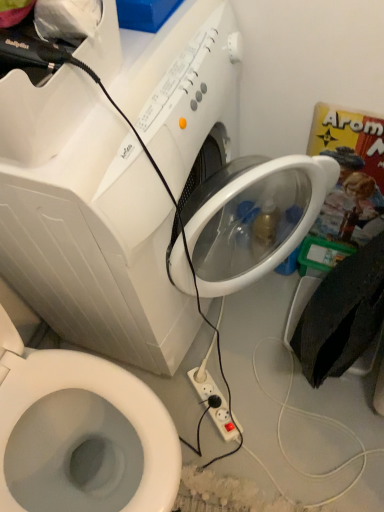
Describe the element at coordinates (209, 398) in the screenshot. I see `white plastic power plugs and sockets at lower center` at that location.

The width and height of the screenshot is (384, 512). I want to click on white plastic washing machine at upper center, so click(99, 242).

What is the approximate height of white plastic bidet at lower left?

The height of white plastic bidet at lower left is 29.74 inches.

This screenshot has height=512, width=384. Find the location of `white plastic power plugs and sockets at lower center`. white plastic power plugs and sockets at lower center is located at coordinates (209, 398).

Does white plastic washing machine at upper center have a greater height compared to white plastic bidet at lower left?

Indeed, white plastic washing machine at upper center has a greater height compared to white plastic bidet at lower left.

Which is more to the right, white plastic washing machine at upper center or white plastic bidet at lower left?

white plastic washing machine at upper center.

What's the angular difference between white plastic washing machine at upper center and white plastic bidet at lower left's facing directions?

The angle between the facing direction of white plastic washing machine at upper center and the facing direction of white plastic bidet at lower left is 6.5 degrees.

From the image's perspective, would you say white plastic washing machine at upper center is positioned over white plastic bidet at lower left?

Yes, from the image's perspective, white plastic washing machine at upper center is above white plastic bidet at lower left.

From a real-world perspective, is white plastic bidet at lower left located beneath white plastic washing machine at upper center?

Yes, from a real-world perspective, white plastic bidet at lower left is below white plastic washing machine at upper center.

Considering the relative sizes of white plastic bidet at lower left and white plastic washing machine at upper center in the image provided, is white plastic bidet at lower left wider than white plastic washing machine at upper center?

Yes.

Considering the relative positions of white plastic bidet at lower left and white plastic washing machine at upper center in the image provided, is white plastic bidet at lower left to the left of white plastic washing machine at upper center from the viewer's perspective?

Correct, you'll find white plastic bidet at lower left to the left of white plastic washing machine at upper center.

Would you say white plastic power plugs and sockets at lower center contains white plastic bidet at lower left?

That's incorrect, white plastic bidet at lower left is not inside white plastic power plugs and sockets at lower center.

Is white plastic power plugs and sockets at lower center not close to white plastic bidet at lower left?

Actually, white plastic power plugs and sockets at lower center and white plastic bidet at lower left are a little close together.

Is white plastic power plugs and sockets at lower center taller than white plastic bidet at lower left?

No, white plastic power plugs and sockets at lower center is not taller than white plastic bidet at lower left.

Is white plastic power plugs and sockets at lower center positioned with its back to white plastic washing machine at upper center?

white plastic power plugs and sockets at lower center is not turned away from white plastic washing machine at upper center.

Where is `washing machine that is above the white plastic power plugs and sockets at lower center (from the image's perspective)`? The image size is (384, 512). washing machine that is above the white plastic power plugs and sockets at lower center (from the image's perspective) is located at coordinates (99, 242).

Looking at this image, does white plastic power plugs and sockets at lower center have a larger size compared to white plastic washing machine at upper center?

No.

Which object is positioned more to the right, white plastic power plugs and sockets at lower center or white plastic washing machine at upper center?

Positioned to the right is white plastic power plugs and sockets at lower center.

Does white plastic bidet at lower left appear on the left side of white plastic power plugs and sockets at lower center?

Yes, white plastic bidet at lower left is to the left of white plastic power plugs and sockets at lower center.

Does white plastic bidet at lower left turn towards white plastic power plugs and sockets at lower center?

Result: No, white plastic bidet at lower left is not turned towards white plastic power plugs and sockets at lower center.

Considering the relative sizes of white plastic bidet at lower left and white plastic power plugs and sockets at lower center in the image provided, is white plastic bidet at lower left bigger than white plastic power plugs and sockets at lower center?

Yes.

How many degrees apart are the facing directions of white plastic bidet at lower left and white plastic power plugs and sockets at lower center?

white plastic bidet at lower left and white plastic power plugs and sockets at lower center are facing 31.6 degrees away from each other.

Image resolution: width=384 pixels, height=512 pixels. I want to click on power plugs and sockets that is below the white plastic washing machine at upper center (from the image's perspective), so click(x=209, y=398).

Measure the distance between white plastic washing machine at upper center and white plastic power plugs and sockets at lower center.

They are 20.92 inches apart.

Which is behind, white plastic washing machine at upper center or white plastic power plugs and sockets at lower center?

white plastic power plugs and sockets at lower center.

Consider the image. Considering the relative sizes of white plastic washing machine at upper center and white plastic power plugs and sockets at lower center in the image provided, is white plastic washing machine at upper center bigger than white plastic power plugs and sockets at lower center?

Correct, white plastic washing machine at upper center is larger in size than white plastic power plugs and sockets at lower center.

In the image, there is a white plastic washing machine at upper center. Identify the location of bidet below it (from a real-world perspective). The image size is (384, 512). (83, 436).

Locate an element on the screen. The image size is (384, 512). bidet on the left of white plastic washing machine at upper center is located at coordinates (83, 436).

Looking at this image, based on their spatial positions, is white plastic washing machine at upper center or white plastic power plugs and sockets at lower center further from white plastic bidet at lower left?

Based on the image, white plastic power plugs and sockets at lower center appears to be further to white plastic bidet at lower left.

From the image, which object appears to be nearer to white plastic power plugs and sockets at lower center, white plastic washing machine at upper center or white plastic bidet at lower left?

Based on the image, white plastic bidet at lower left appears to be nearer to white plastic power plugs and sockets at lower center.

Consider the image. Estimate the real-world distances between objects in this image. Which object is further from white plastic washing machine at upper center, white plastic power plugs and sockets at lower center or white plastic bidet at lower left?

white plastic power plugs and sockets at lower center is positioned further to the anchor white plastic washing machine at upper center.

Based on the photo, when comparing their distances from white plastic power plugs and sockets at lower center, does white plastic bidet at lower left or white plastic washing machine at upper center seem closer?

The object closer to white plastic power plugs and sockets at lower center is white plastic bidet at lower left.

Considering their positions, is white plastic bidet at lower left positioned closer to white plastic washing machine at upper center than white plastic power plugs and sockets at lower center?

white plastic bidet at lower left is closer to white plastic washing machine at upper center.

Considering their positions, is white plastic power plugs and sockets at lower center positioned closer to white plastic bidet at lower left than white plastic washing machine at upper center?

white plastic washing machine at upper center is closer to white plastic bidet at lower left.

At what (x,y) coordinates should I click in order to perform the action: click on washing machine between white plastic bidet at lower left and white plastic power plugs and sockets at lower center in the front-back direction. Please return your answer as a coordinate pair (x, y). This screenshot has width=384, height=512. Looking at the image, I should click on (99, 242).